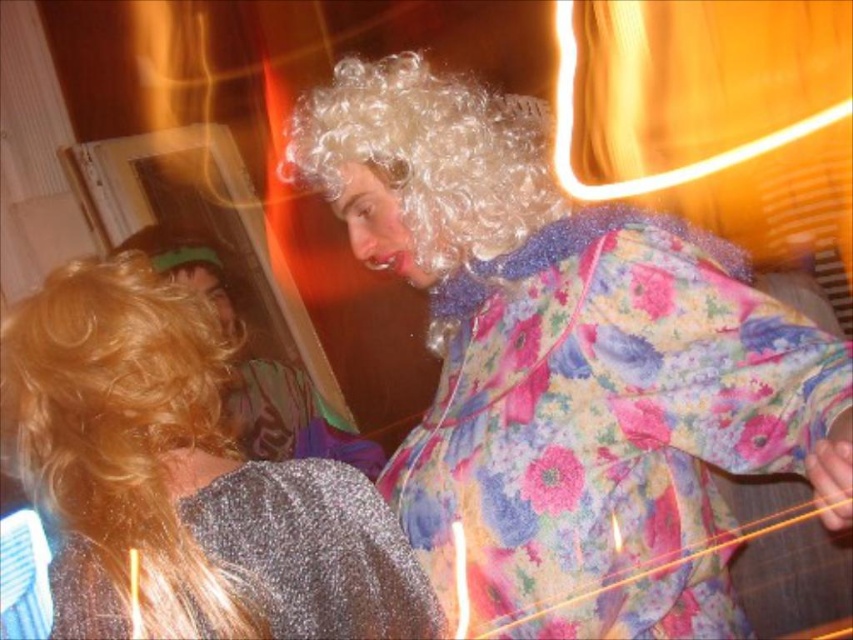
You are at a party and see two items at the lower left corner of the scene. The shiny silver dress at lower left and the sparkly silver robe at lower left. Which one is larger in size?

The shiny silver dress at lower left is bigger than the sparkly silver robe at lower left, so the shiny silver dress at lower left is larger in size.